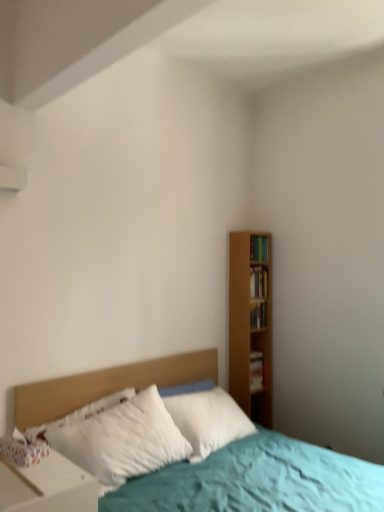
Find the location of a particular element. This screenshot has height=512, width=384. free point above wooden bookshelf at right, arranged as the 3th book when viewed from the top (from a real-world perspective) is located at coordinates (258, 304).